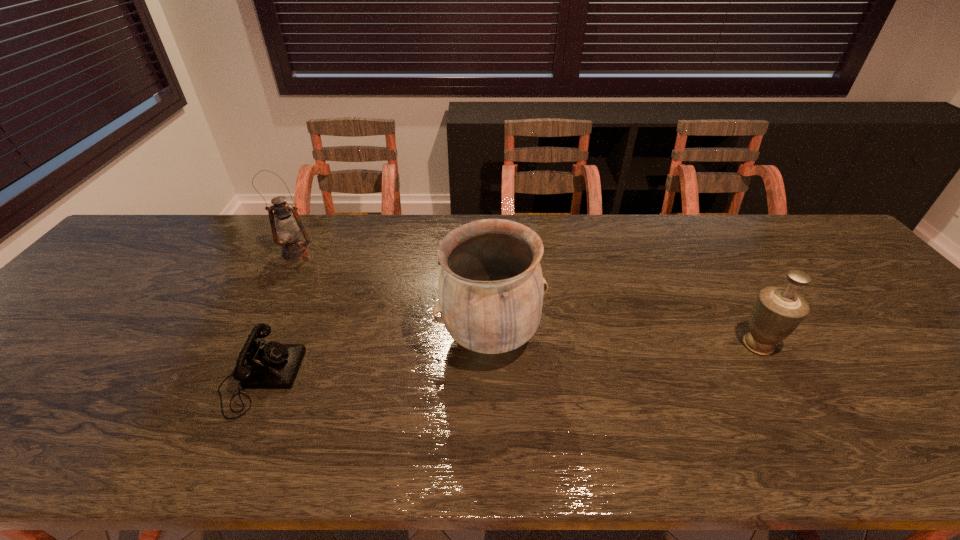
Identify the location of object present at the far edge. (288, 228).

Find the location of a particular element. The image size is (960, 540). free space at the far edge of the desktop is located at coordinates (253, 259).

At what (x,y) coordinates should I click in order to perform the action: click on vacant point at the near edge. Please return your answer as a coordinate pair (x, y). This screenshot has width=960, height=540. Looking at the image, I should click on (197, 441).

The height and width of the screenshot is (540, 960). What are the coordinates of `free spot at the left edge of the desktop` in the screenshot? It's located at (132, 261).

The width and height of the screenshot is (960, 540). I want to click on free space at the far right corner of the desktop, so click(825, 255).

Locate an element on the screen. free space between the left urn and the shorter urn is located at coordinates (624, 341).

The height and width of the screenshot is (540, 960). I want to click on free space between the telephone and the second object from right to left, so click(375, 357).

Locate an element on the screen. free space between the second shortest object and the second object from right to left is located at coordinates pos(624,341).

Locate an element on the screen. vacant point located between the oil lamp and the left urn is located at coordinates (394, 295).

The image size is (960, 540). In order to click on free point between the farthest object and the taller urn in this screenshot , I will do `click(394, 295)`.